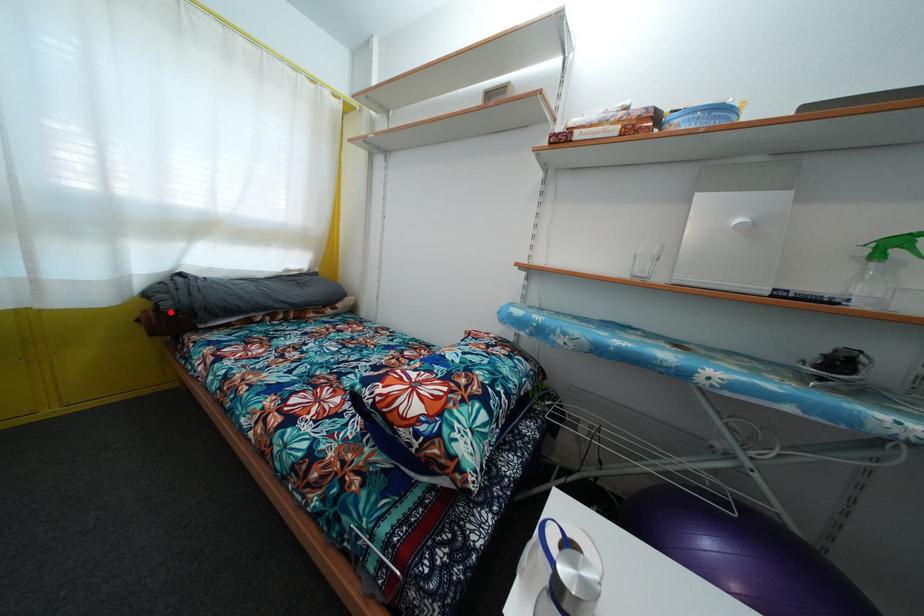
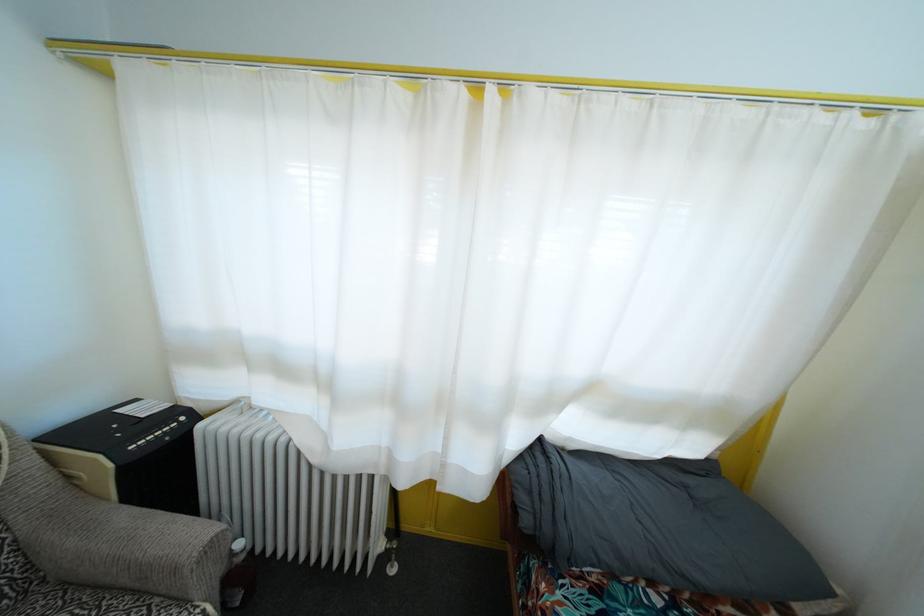
Question: I am providing you with two images of the same scene from different viewpoints. In image1, a red point is highlighted. Considering the same 3D point in image2, which of the following is correct?

Choices:
 (A) It is closer
 (B) It is farther

Answer: (B)